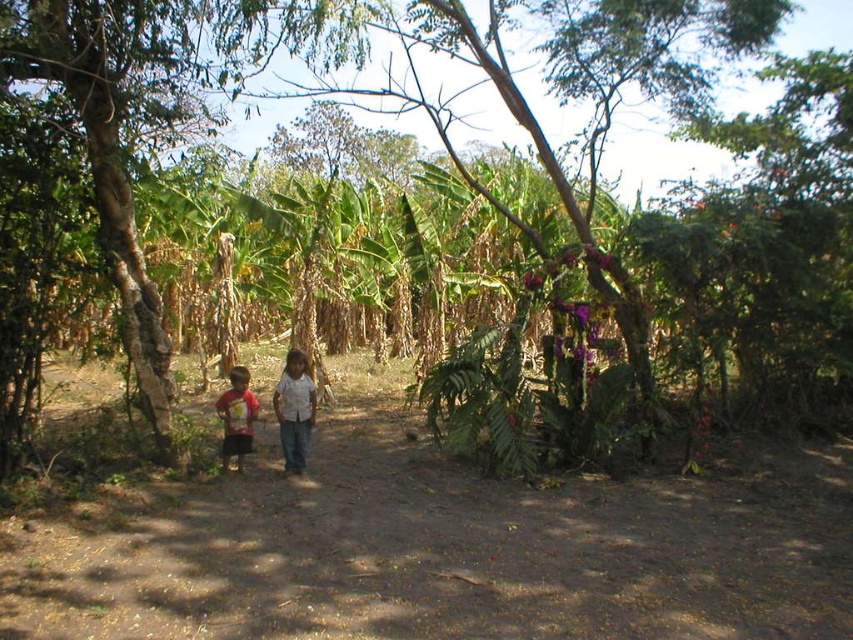
How much distance is there between brown dirt path at center and white cotton shirt at center?

A distance of 11.19 feet exists between brown dirt path at center and white cotton shirt at center.

Does point (10, 566) come in front of point (285, 419)?

Yes, point (10, 566) is in front of point (285, 419).

This screenshot has height=640, width=853. Identify the location of brown dirt path at center. (444, 547).

The width and height of the screenshot is (853, 640). Find the location of `brown dirt path at center`. brown dirt path at center is located at coordinates (444, 547).

Locate an element on the screen. The height and width of the screenshot is (640, 853). brown dirt path at center is located at coordinates (444, 547).

Can you confirm if brown dirt path at center is shorter than red t-shirt at left?

Correct, brown dirt path at center is not as tall as red t-shirt at left.

In order to click on brown dirt path at center in this screenshot , I will do `click(444, 547)`.

Does white cotton shirt at center appear on the right side of red t-shirt at left?

Correct, you'll find white cotton shirt at center to the right of red t-shirt at left.

Is white cotton shirt at center bigger than red t-shirt at left?

Indeed, white cotton shirt at center has a larger size compared to red t-shirt at left.

The height and width of the screenshot is (640, 853). Describe the element at coordinates (294, 410) in the screenshot. I see `white cotton shirt at center` at that location.

You are a GUI agent. You are given a task and a screenshot of the screen. Output one action in this format:
    pyautogui.click(x=<x>, y=<y>)
    Task: Click on the white cotton shirt at center
    The height and width of the screenshot is (640, 853).
    Given the screenshot: What is the action you would take?
    pyautogui.click(x=294, y=410)